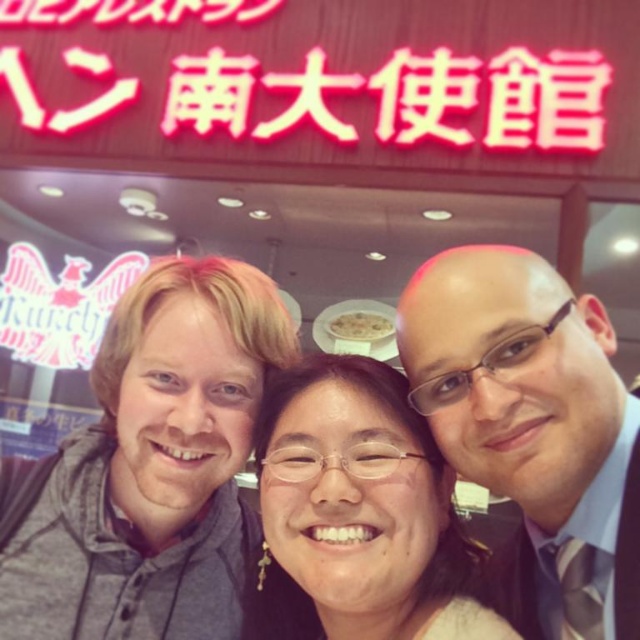
Between gray hoodie at center and neon red sign at upper center, which one appears on the left side from the viewer's perspective?

Positioned to the left is neon red sign at upper center.

Does gray hoodie at center have a greater width compared to neon red sign at upper center?

In fact, gray hoodie at center might be narrower than neon red sign at upper center.

Who is more forward, [195,284] or [566,58]?

Point [195,284] is more forward.

The height and width of the screenshot is (640, 640). I want to click on gray hoodie at center, so click(x=154, y=467).

Can you confirm if gray hoodie at center is thinner than matte black suit at center?

In fact, gray hoodie at center might be wider than matte black suit at center.

Which is behind, point (8, 596) or point (436, 348)?

Point (8, 596)

I want to click on gray hoodie at center, so click(154, 467).

In the scene shown: Is matte black suit at center bigger than neon red sign at upper center?

Incorrect, matte black suit at center is not larger than neon red sign at upper center.

Between matte black suit at center and neon red sign at upper center, which one has less height?

With less height is matte black suit at center.

You are a GUI agent. You are given a task and a screenshot of the screen. Output one action in this format:
    pyautogui.click(x=<x>, y=<y>)
    Task: Click on the matte black suit at center
    The image size is (640, 640).
    Given the screenshot: What is the action you would take?
    pyautogui.click(x=532, y=429)

You are a GUI agent. You are given a task and a screenshot of the screen. Output one action in this format:
    pyautogui.click(x=<x>, y=<y>)
    Task: Click on the matte black suit at center
    This screenshot has width=640, height=640.
    Given the screenshot: What is the action you would take?
    pyautogui.click(x=532, y=429)